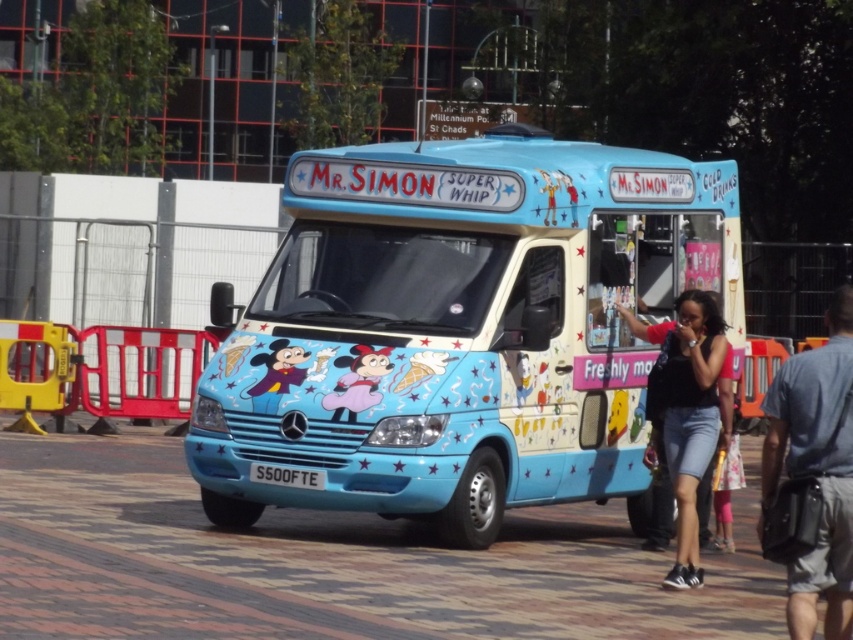
You are standing at the position of point (833,474) and want to walk to the point (556,291). According to the scene, will you be moving towards the front of the ice cream van or away from it?

Since point (556,291) is behind point (833,474), moving from point (833,474) to point (556,291) means you are moving towards the front of the ice cream van because the front is in the direction opposite to where the point is located.